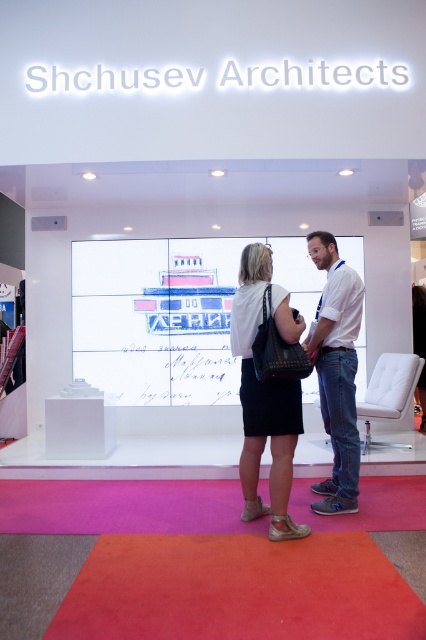
Question: Is white matte skirt at center above white cotton shirt at center?

Choices:
 (A) yes
 (B) no

Answer: (B)

Question: Which point is farther from the camera taking this photo?

Choices:
 (A) (279, 534)
 (B) (336, 356)

Answer: (B)

Question: Is white matte skirt at center closer to camera compared to white cotton shirt at center?

Choices:
 (A) no
 (B) yes

Answer: (B)

Question: Observing the image, what is the correct spatial positioning of white matte skirt at center in reference to white cotton shirt at center?

Choices:
 (A) left
 (B) right

Answer: (A)